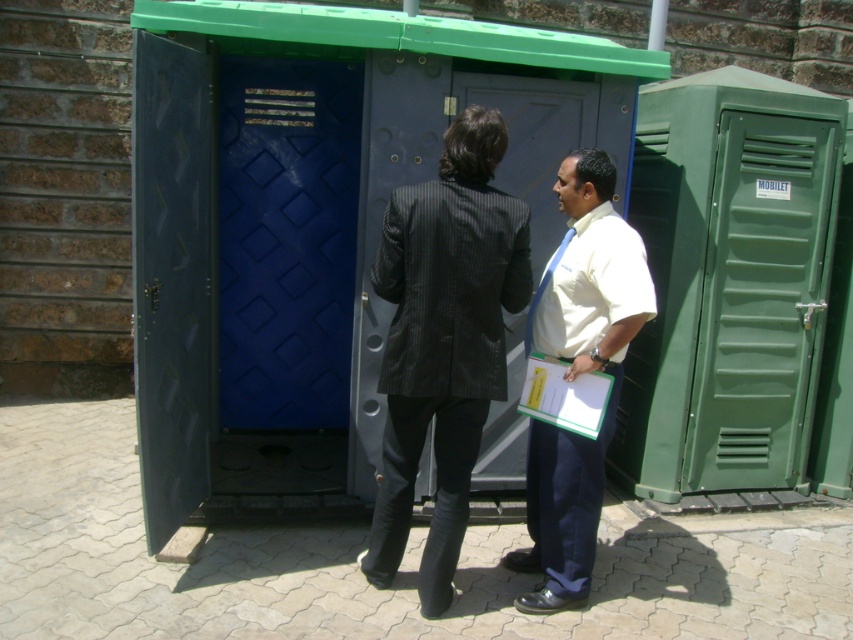
Question: Where is dark gray pinstripe suit at center located in relation to white shirt at center in the image?

Choices:
 (A) right
 (B) left

Answer: (B)

Question: Is dark gray pinstripe suit at center further to the viewer compared to green plastic door at right?

Choices:
 (A) no
 (B) yes

Answer: (A)

Question: Which point is closer to the camera?

Choices:
 (A) (715, 211)
 (B) (471, 170)

Answer: (B)

Question: Which object is positioned closest to the white shirt at center?

Choices:
 (A) dark gray pinstripe suit at center
 (B) green plastic door at right

Answer: (A)

Question: Does dark gray pinstripe suit at center appear on the left side of green plastic door at right?

Choices:
 (A) yes
 (B) no

Answer: (A)

Question: Which of these objects is positioned farthest from the dark gray pinstripe suit at center?

Choices:
 (A) green plastic door at right
 (B) white shirt at center

Answer: (A)